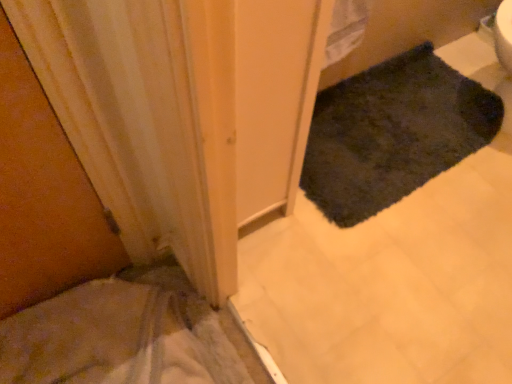
Find the location of a particular element. The image size is (512, 384). dark fuzzy bath mat at lower right is located at coordinates (393, 133).

Describe the element at coordinates (393, 133) in the screenshot. Image resolution: width=512 pixels, height=384 pixels. I see `dark fuzzy bath mat at lower right` at that location.

Locate an element on the screen. The image size is (512, 384). dark fuzzy bath mat at lower right is located at coordinates (393, 133).